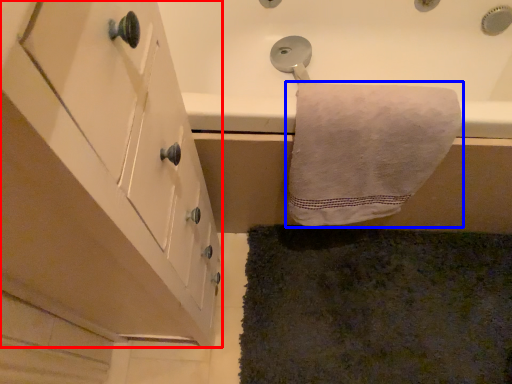
Question: Which object appears closest to the camera in this image, cabinetry (highlighted by a red box) or towel (highlighted by a blue box)?

Choices:
 (A) cabinetry
 (B) towel

Answer: (A)